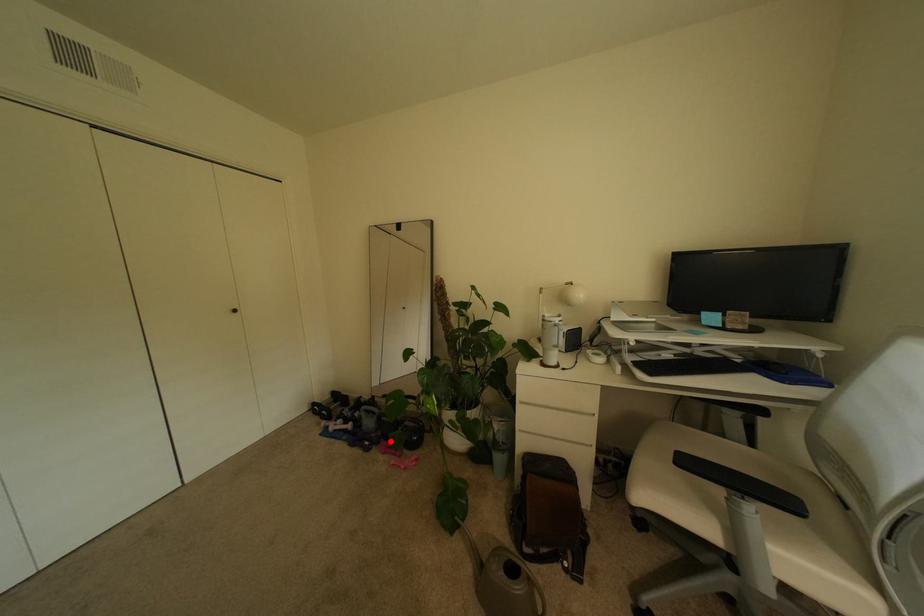
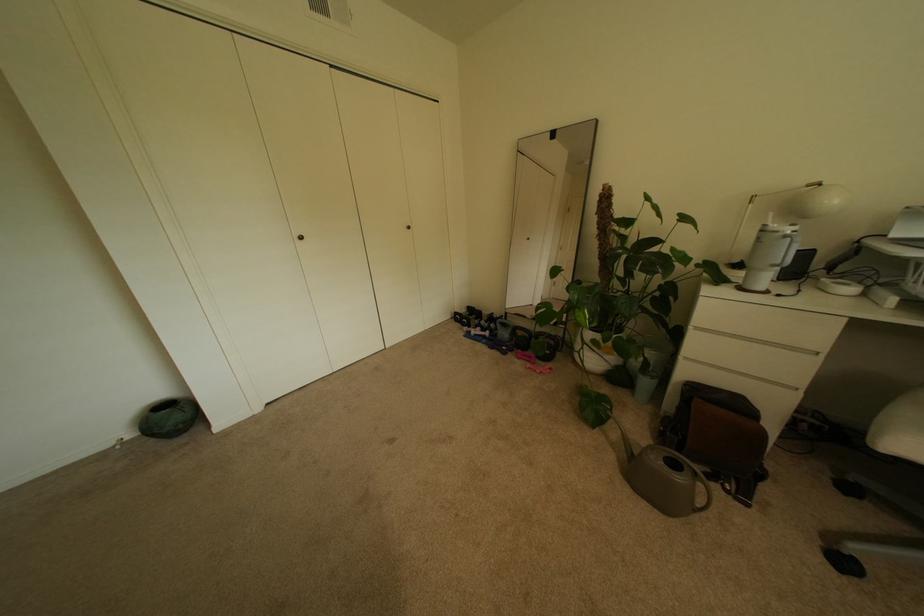
Locate, in the second image, the point that corresponds to the highlighted location in the first image.

(524, 350)